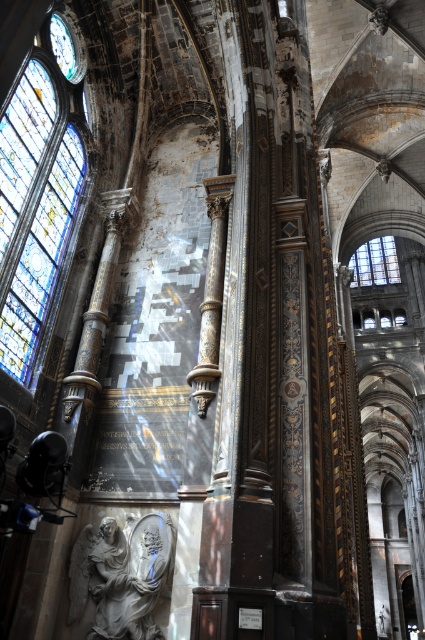
Is the position of stained glass window at left more distant than that of stained glass window at upper right?

No, it is in front of stained glass window at upper right.

Is stained glass window at left taller than stained glass window at upper right?

Yes.

Find the location of a particular element. The image size is (425, 640). stained glass window at left is located at coordinates (39, 193).

Consider the image. Can you confirm if white marble statue at center is positioned above metallic clock face at upper left?

Actually, white marble statue at center is below metallic clock face at upper left.

Between point (112, 557) and point (56, 26), which one is positioned in front?

Point (112, 557)

Where is `white marble statue at center`? The image size is (425, 640). white marble statue at center is located at coordinates (121, 576).

Is stained glass window at left above white marble statue at center?

Indeed, stained glass window at left is positioned over white marble statue at center.

Based on the photo, between stained glass window at left and white marble statue at center, which one appears on the left side from the viewer's perspective?

From the viewer's perspective, stained glass window at left appears more on the left side.

Is point (14, 282) farther from viewer compared to point (96, 552)?

Yes, point (14, 282) is behind point (96, 552).

The height and width of the screenshot is (640, 425). I want to click on stained glass window at left, so click(39, 193).